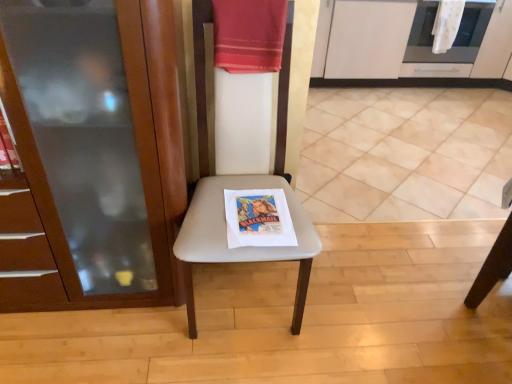
This screenshot has width=512, height=384. Find the location of `free space between beige fabric chair at center and matte wood cabinet at left, the second cabinetry in the right-to-left sequence`. free space between beige fabric chair at center and matte wood cabinet at left, the second cabinetry in the right-to-left sequence is located at coordinates (111, 333).